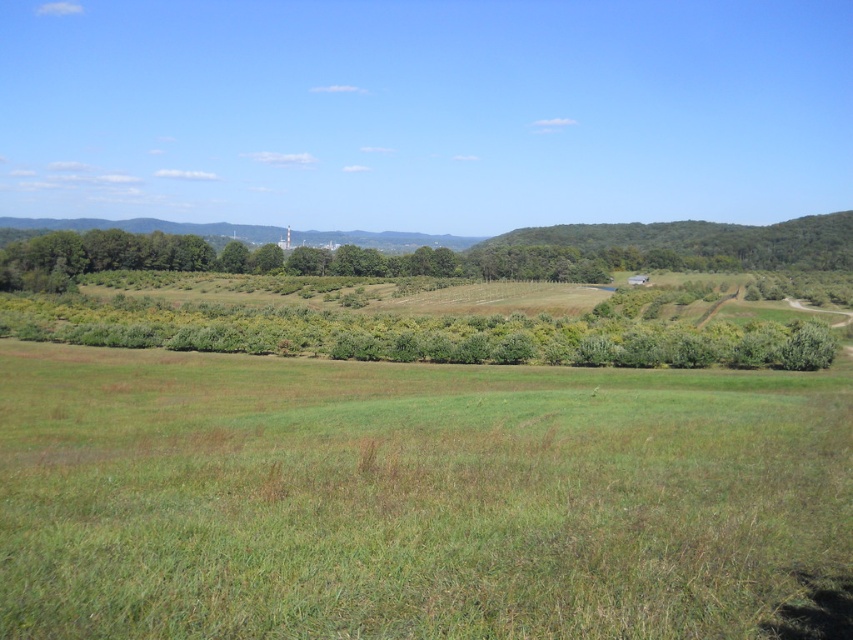
Who is lower down, green grassy field at center or green leafy trees at center?

green grassy field at center is below.

This screenshot has height=640, width=853. In order to click on green grassy field at center in this screenshot , I will do `click(410, 497)`.